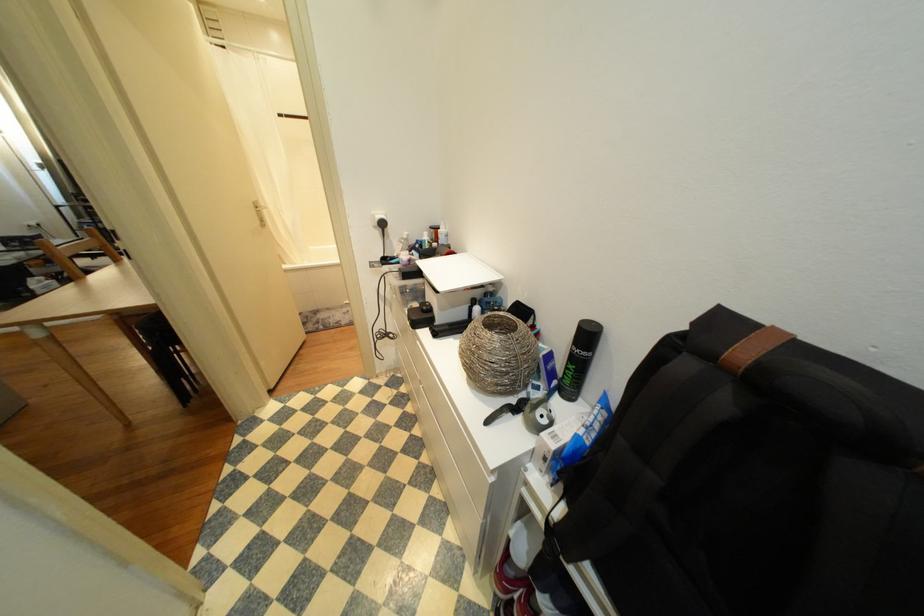
What do you see at coordinates (578, 359) in the screenshot?
I see `the black spray can` at bounding box center [578, 359].